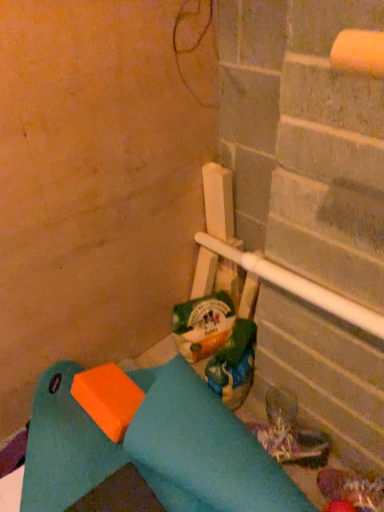
Where is `green plastic bag at center`? green plastic bag at center is located at coordinates (217, 345).

The height and width of the screenshot is (512, 384). What do you see at coordinates (217, 345) in the screenshot?
I see `green plastic bag at center` at bounding box center [217, 345].

I want to click on leather-like brown boot at lower right, so coord(292,443).

What is the approximate height of leather-like brown boot at lower right?

leather-like brown boot at lower right is 4.52 inches in height.

What do you see at coordinates (292, 443) in the screenshot?
I see `leather-like brown boot at lower right` at bounding box center [292, 443].

Identify the location of green plastic bag at center. (217, 345).

In the image, is green plastic bag at center on the left side or the right side of leather-like brown boot at lower right?

green plastic bag at center is to the left of leather-like brown boot at lower right.

Which is behind, green plastic bag at center or leather-like brown boot at lower right?

green plastic bag at center is more distant.

Considering the positions of point (248, 323) and point (282, 424), is point (248, 323) closer or farther from the camera than point (282, 424)?

Point (248, 323).

From the image's perspective, who appears lower, green plastic bag at center or leather-like brown boot at lower right?

leather-like brown boot at lower right appears lower in the image.

From a real-world perspective, between green plastic bag at center and leather-like brown boot at lower right, who is vertically lower?

leather-like brown boot at lower right.

Looking at their sizes, would you say green plastic bag at center is wider or thinner than leather-like brown boot at lower right?

green plastic bag at center is thinner than leather-like brown boot at lower right.

Who is shorter, green plastic bag at center or leather-like brown boot at lower right?

leather-like brown boot at lower right.

Looking at the image, does green plastic bag at center seem bigger or smaller compared to leather-like brown boot at lower right?

Considering their sizes, green plastic bag at center takes up more space than leather-like brown boot at lower right.

In the scene shown: Which is correct: green plastic bag at center is inside leather-like brown boot at lower right, or outside of it?

green plastic bag at center exists outside the volume of leather-like brown boot at lower right.

Is green plastic bag at center not close to leather-like brown boot at lower right?

Actually, green plastic bag at center and leather-like brown boot at lower right are a little close together.

Does green plastic bag at center turn towards leather-like brown boot at lower right?

No, green plastic bag at center does not turn towards leather-like brown boot at lower right.

How different are the orientations of green plastic bag at center and leather-like brown boot at lower right in degrees?

The facing directions of green plastic bag at center and leather-like brown boot at lower right are 62.7 degrees apart.

You are a GUI agent. You are given a task and a screenshot of the screen. Output one action in this format:
    pyautogui.click(x=<x>, y=<y>)
    Task: Click on the footwear lying in front of the green plastic bag at center
    The height and width of the screenshot is (512, 384).
    Given the screenshot: What is the action you would take?
    pyautogui.click(x=292, y=443)

Between leather-like brown boot at lower right and green plastic bag at center, which one appears on the left side from the viewer's perspective?

green plastic bag at center is more to the left.

Is leather-like brown boot at lower right positioned before green plastic bag at center?

Yes, the depth of leather-like brown boot at lower right is less than that of green plastic bag at center.

Considering the positions of points (285, 430) and (222, 293), is point (285, 430) farther from camera compared to point (222, 293)?

No, (285, 430) is in front of (222, 293).

From the image's perspective, is leather-like brown boot at lower right positioned above or below green plastic bag at center?

→ leather-like brown boot at lower right is situated lower than green plastic bag at center in the image.

From a real-world perspective, is leather-like brown boot at lower right physically located above or below green plastic bag at center?

From a real-world perspective, leather-like brown boot at lower right is physically below green plastic bag at center.

Which object is wider, leather-like brown boot at lower right or green plastic bag at center?

leather-like brown boot at lower right.

Is leather-like brown boot at lower right taller than green plastic bag at center?

No, leather-like brown boot at lower right is not taller than green plastic bag at center.

Looking at the image, does leather-like brown boot at lower right seem bigger or smaller compared to green plastic bag at center?

Clearly, leather-like brown boot at lower right is smaller in size than green plastic bag at center.

Can we say leather-like brown boot at lower right lies outside green plastic bag at center?

leather-like brown boot at lower right lies outside green plastic bag at center's area.

Is leather-like brown boot at lower right positioned far away from green plastic bag at center?

They are positioned close to each other.

Is leather-like brown boot at lower right positioned with its back to green plastic bag at center?

leather-like brown boot at lower right is not turned away from green plastic bag at center.

I want to click on garbage behind the leather-like brown boot at lower right, so click(x=217, y=345).

The width and height of the screenshot is (384, 512). In order to click on garbage on the left of leather-like brown boot at lower right in this screenshot , I will do `click(217, 345)`.

In order to click on footwear lying in front of the green plastic bag at center in this screenshot , I will do `click(292, 443)`.